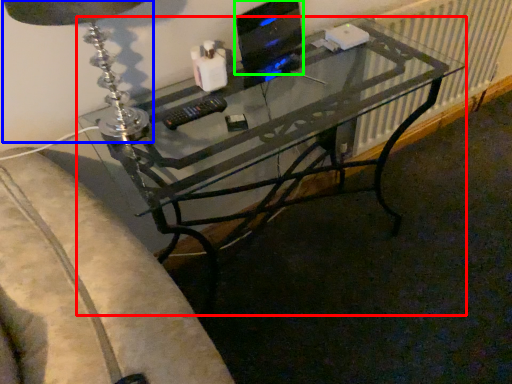
Question: Which object is the closest to the desk (highlighted by a red box)? Choose among these: table lamp (highlighted by a blue box) or computer monitor (highlighted by a green box).

Choices:
 (A) table lamp
 (B) computer monitor

Answer: (B)